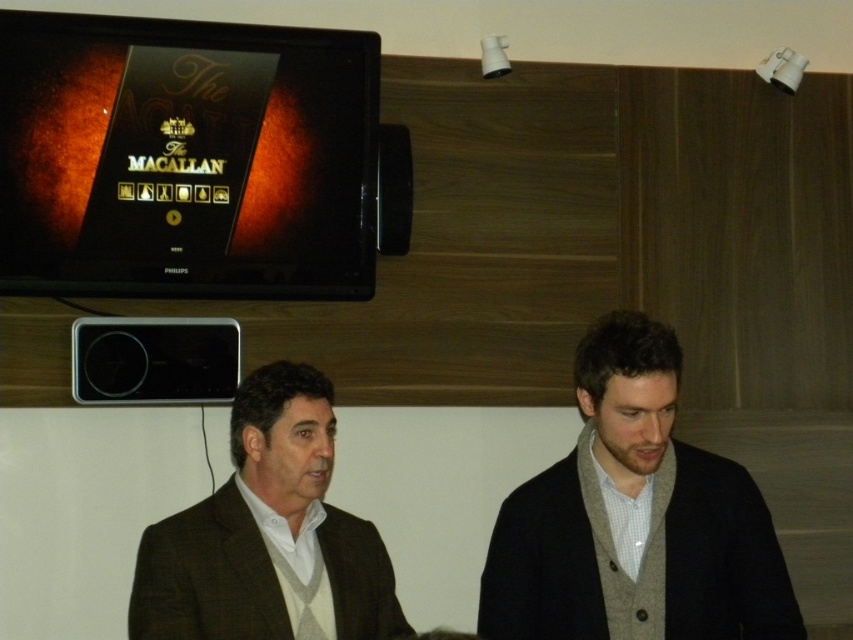
Question: Can you confirm if dark brown wool sweater at right is wider than black plastic speaker at upper center?

Choices:
 (A) yes
 (B) no

Answer: (A)

Question: Among these points, which one is nearest to the camera?

Choices:
 (A) (80, 323)
 (B) (654, 456)
 (C) (349, 586)
 (D) (405, 227)

Answer: (B)

Question: Which object appears farthest from the camera in this image?

Choices:
 (A) black plastic speaker at upper left
 (B) black plastic speaker at upper center
 (C) brown woolen sweater at center

Answer: (B)

Question: Among these points, which one is nearest to the camera?

Choices:
 (A) pos(109,365)
 (B) pos(405,212)

Answer: (A)

Question: Is dark brown wool sweater at right thinner than brown woolen sweater at center?

Choices:
 (A) no
 (B) yes

Answer: (A)

Question: Can you confirm if dark brown wool sweater at right is bigger than black plastic speaker at upper left?

Choices:
 (A) no
 (B) yes

Answer: (B)